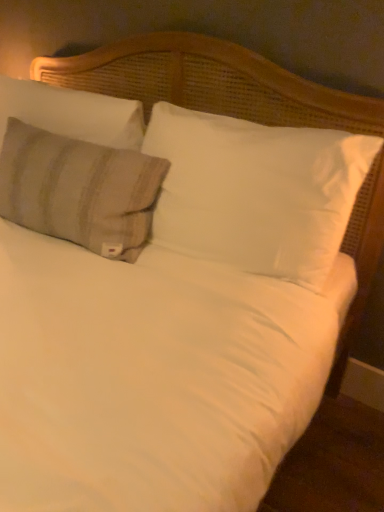
Question: Does white soft pillow at center, the third pillow when ordered from left to right, have a smaller size compared to beige striped pillow at left, which ranks as the 1th pillow in left-to-right order?

Choices:
 (A) yes
 (B) no

Answer: (B)

Question: Is white soft pillow at center, which is the first pillow in right-to-left order, at the left side of beige striped pillow at left, which is the 3th pillow in right-to-left order?

Choices:
 (A) yes
 (B) no

Answer: (B)

Question: Considering the relative sizes of white soft pillow at center, the third pillow when ordered from left to right, and beige striped pillow at left, which is the 3th pillow in right-to-left order, in the image provided, is white soft pillow at center, the third pillow when ordered from left to right, bigger than beige striped pillow at left, which is the 3th pillow in right-to-left order,?

Choices:
 (A) no
 (B) yes

Answer: (B)

Question: Is white soft pillow at center, the third pillow when ordered from left to right, taller than beige striped pillow at left, which ranks as the 1th pillow in left-to-right order?

Choices:
 (A) no
 (B) yes

Answer: (B)

Question: Is the depth of white soft pillow at center, which is the first pillow in right-to-left order, greater than that of beige striped pillow at left, which ranks as the 1th pillow in left-to-right order?

Choices:
 (A) yes
 (B) no

Answer: (B)

Question: Relative to beige striped pillow at left, which is the 3th pillow in right-to-left order, is white soft pillow at center, which is the first pillow in right-to-left order, in front or behind?

Choices:
 (A) front
 (B) behind

Answer: (A)

Question: Is white soft pillow at center, which is the first pillow in right-to-left order, to the left or to the right of beige striped pillow at left, which is the 3th pillow in right-to-left order, in the image?

Choices:
 (A) left
 (B) right

Answer: (B)

Question: From the image's perspective, is white soft pillow at center, which is the first pillow in right-to-left order, located above or below beige striped pillow at left, which is the 3th pillow in right-to-left order?

Choices:
 (A) below
 (B) above

Answer: (A)

Question: Is point coord(340,133) positioned closer to the camera than point coord(86,98)?

Choices:
 (A) farther
 (B) closer

Answer: (B)

Question: Considering the positions of beige striped pillow at left, which is the 3th pillow in right-to-left order, and beige striped fabric pillow at upper left, acting as the 2th pillow starting from the left, in the image, is beige striped pillow at left, which is the 3th pillow in right-to-left order, bigger or smaller than beige striped fabric pillow at upper left, acting as the 2th pillow starting from the left,?

Choices:
 (A) small
 (B) big

Answer: (A)

Question: From a real-world perspective, relative to beige striped fabric pillow at upper left, acting as the 2th pillow starting from the left, is beige striped pillow at left, which ranks as the 1th pillow in left-to-right order, vertically above or below?

Choices:
 (A) above
 (B) below

Answer: (A)

Question: Considering the positions of point (62, 112) and point (18, 222), is point (62, 112) closer or farther from the camera than point (18, 222)?

Choices:
 (A) farther
 (B) closer

Answer: (A)

Question: In terms of width, does beige striped pillow at left, which is the 3th pillow in right-to-left order, look wider or thinner when compared to beige striped fabric pillow at upper left, which is counted as the 2th pillow, starting from the right?

Choices:
 (A) wide
 (B) thin

Answer: (B)

Question: Looking at the image, does beige striped fabric pillow at upper left, which is counted as the 2th pillow, starting from the right, seem bigger or smaller compared to beige striped pillow at left, which ranks as the 1th pillow in left-to-right order?

Choices:
 (A) big
 (B) small

Answer: (A)

Question: Relative to beige striped pillow at left, which ranks as the 1th pillow in left-to-right order, is beige striped fabric pillow at upper left, which is counted as the 2th pillow, starting from the right, in front or behind?

Choices:
 (A) front
 (B) behind

Answer: (A)